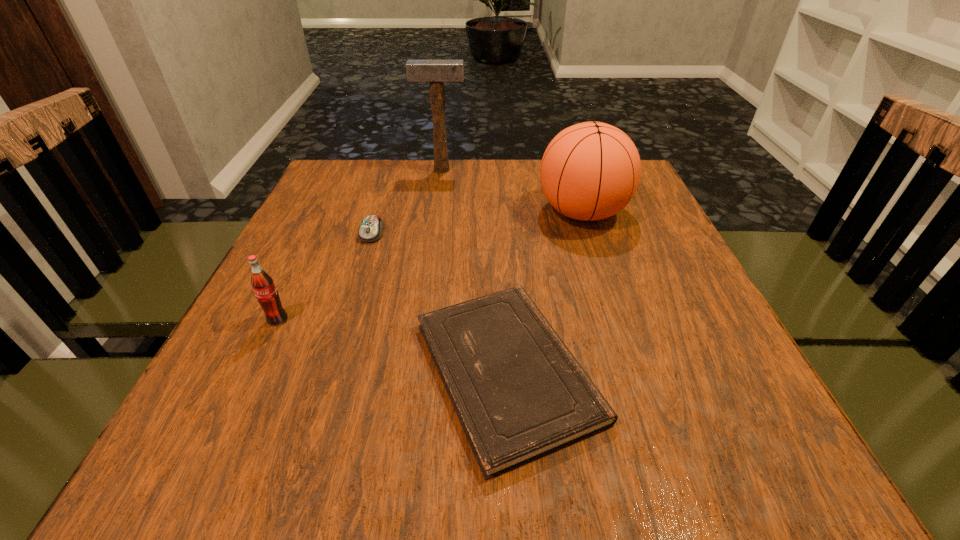
Identify the location of the farthest object. Image resolution: width=960 pixels, height=540 pixels. (436, 72).

Identify the location of mallet. (436, 72).

Locate an element on the screen. This screenshot has width=960, height=540. the second tallest object is located at coordinates (590, 171).

This screenshot has width=960, height=540. In order to click on soda bottle in this screenshot , I will do `click(262, 283)`.

The width and height of the screenshot is (960, 540). In order to click on the leftmost object in this screenshot , I will do `click(262, 283)`.

Find the location of a particular element. Image resolution: width=960 pixels, height=540 pixels. computer mouse is located at coordinates (371, 229).

Locate an element on the screen. paperback book is located at coordinates (519, 393).

Where is `blank space located 0.270m on the right of the tallest object`? blank space located 0.270m on the right of the tallest object is located at coordinates (563, 170).

Locate an element on the screen. The width and height of the screenshot is (960, 540). free location located on the left of the basketball is located at coordinates (420, 212).

Image resolution: width=960 pixels, height=540 pixels. I want to click on vacant area situated on the label of the soda bottle, so click(x=220, y=443).